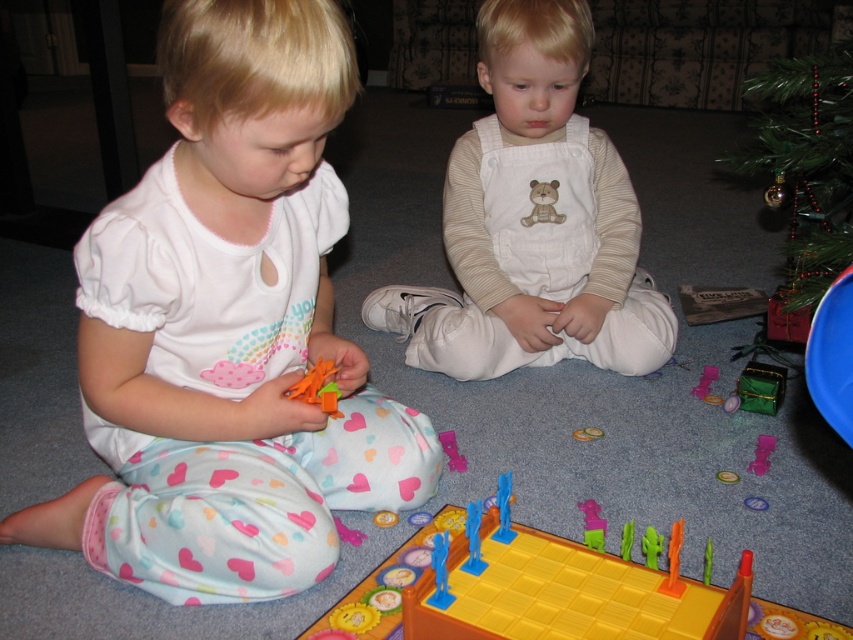
You are a parent observing your children playing. You see the yellow plastic board game at lower center and the soft plush bear at center. Which object is taller?

The yellow plastic board game at lower center is taller than the soft plush bear at center.

You are a child who wants to place the green matte toy boat at lower right on top of the yellow plastic board game at lower center. Can you do this without moving either object?

The distance between the yellow plastic board game at lower center and the green matte toy boat at lower right is 30.33 inches. Since the boat is not on top of the board game, you cannot place it there without moving at least one of them.

You are a parent trying to clean up the play area. You need to move the green textured christmas tree at upper right and the soft plush bear at center. Which object should you move first if you want to access the other one?

You should move the green textured christmas tree at upper right first because it is in front of the soft plush bear at center, so removing it will allow access to the bear.